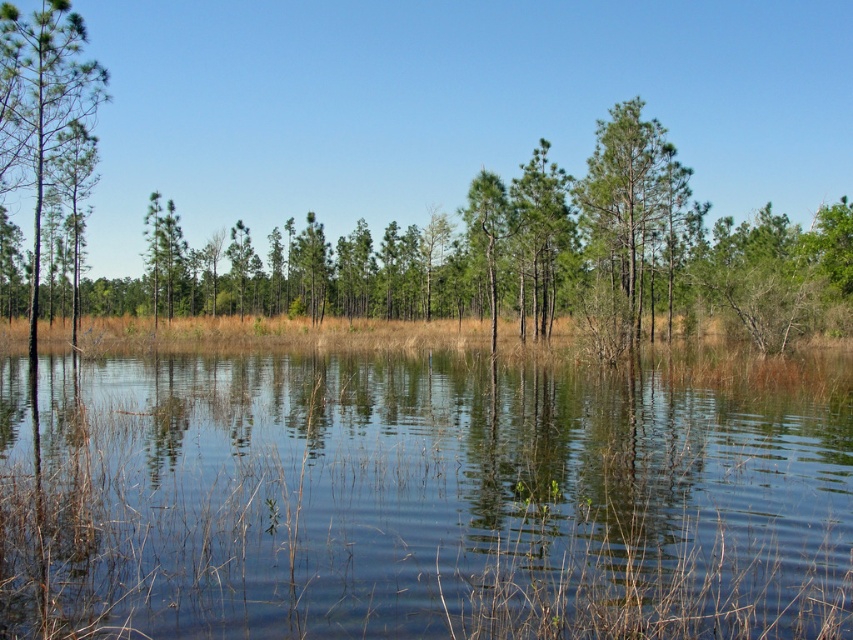
Between point (366, 481) and point (630, 148), which one is positioned in front?

Point (366, 481) is in front.

Between point (815, 493) and point (648, 259), which one is positioned behind?

Positioned behind is point (648, 259).

Find the location of a particular element. The image size is (853, 640). clear water at center is located at coordinates (413, 502).

How distant is clear water at center from green matte tree at left?

A distance of 17.23 meters exists between clear water at center and green matte tree at left.

Is clear water at center to the right of green matte tree at left from the viewer's perspective?

Yes, clear water at center is to the right of green matte tree at left.

What do you see at coordinates (413, 502) in the screenshot? I see `clear water at center` at bounding box center [413, 502].

Where is `clear water at center`? clear water at center is located at coordinates (413, 502).

Which is behind, point (659, 156) or point (70, 38)?

Point (659, 156)

Looking at this image, who is more distant from viewer, (587,232) or (70,28)?

Positioned behind is point (587,232).

The width and height of the screenshot is (853, 640). Find the location of `green matte tree at center`. green matte tree at center is located at coordinates (633, 202).